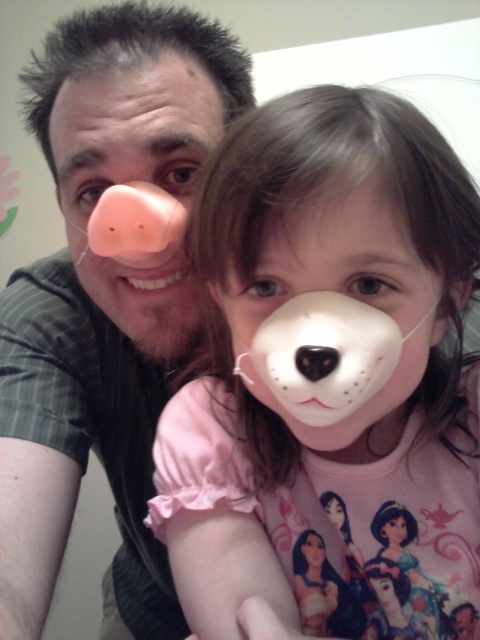
Looking at this image, you are a photographer setting up a shot for a family portrait. You notice two decorative items in the background that could distract from the subjects. The matte pink nose at upper left and the white rubber dog nose at upper center. Which of these two items is positioned higher up in the frame?

The matte pink nose at upper left is much taller than the white rubber dog nose at upper center, so it is positioned higher up in the frame.

You are a photographer taking a picture of the adult male and the young girl wearing masks. You notice a specific point in the image at coordinates point (104, 298). What object is located at that point?

The point (104, 298) indicates the location of the matte pink nose at upper left.

Based on the scene description, which object is taller between the white matte dog nose mask at center and the white rubber dog nose at upper center?

The white matte dog nose mask at center is taller than the white rubber dog nose at upper center.